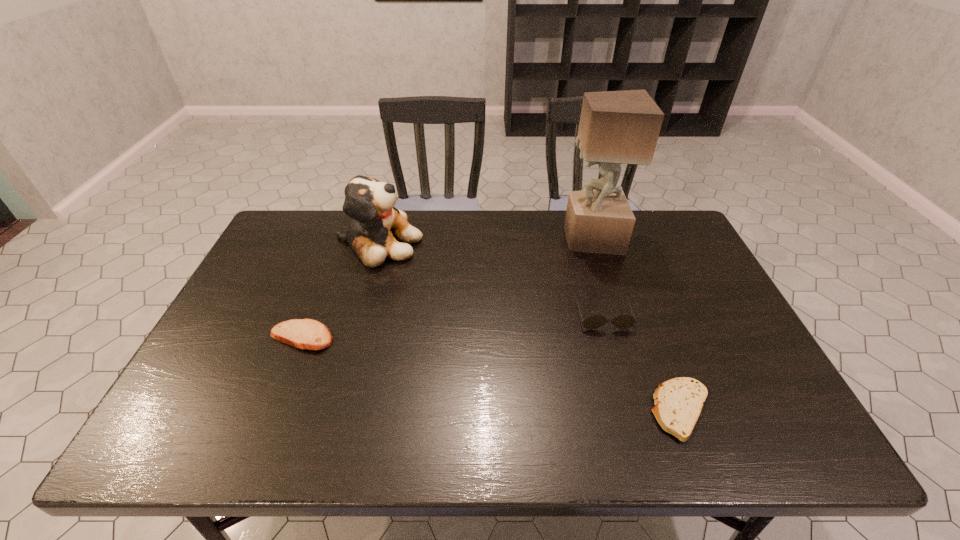
I want to click on vacant space located 0.100m on the front-facing side of the third shortest object, so click(615, 361).

You are a GUI agent. You are given a task and a screenshot of the screen. Output one action in this format:
    pyautogui.click(x=<x>, y=<y>)
    Task: Click on the vacant space situated on the back of the farther pita bread
    The image size is (960, 540).
    Given the screenshot: What is the action you would take?
    pyautogui.click(x=323, y=284)

Identify the location of vacant space located on the back of the shorter pita bread. (651, 329).

Locate an element on the screen. Image resolution: width=960 pixels, height=540 pixels. sculpture that is at the far edge is located at coordinates point(616,127).

The height and width of the screenshot is (540, 960). What are the coordinates of `puppy situated at the far edge` in the screenshot? It's located at (375, 224).

Where is `object at the near edge`? The height and width of the screenshot is (540, 960). object at the near edge is located at coordinates (678, 402).

Where is `object that is at the left edge`? This screenshot has width=960, height=540. object that is at the left edge is located at coordinates (308, 334).

Find the location of a particular element. The image size is (960, 540). free space at the far edge of the desktop is located at coordinates point(511,239).

The height and width of the screenshot is (540, 960). What are the coordinates of `free location at the near edge of the desktop` in the screenshot? It's located at (523, 442).

The height and width of the screenshot is (540, 960). I want to click on blank area at the left edge, so click(x=195, y=402).